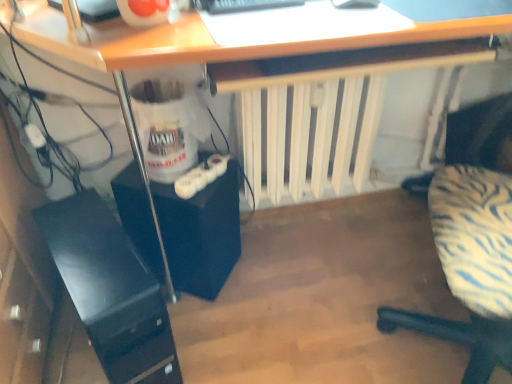
Locate an element on the screen. The image size is (512, 384). vacant area that lies in front of black matte computer tower at lower left, the 1th computer tower viewed from the right is located at coordinates (211, 334).